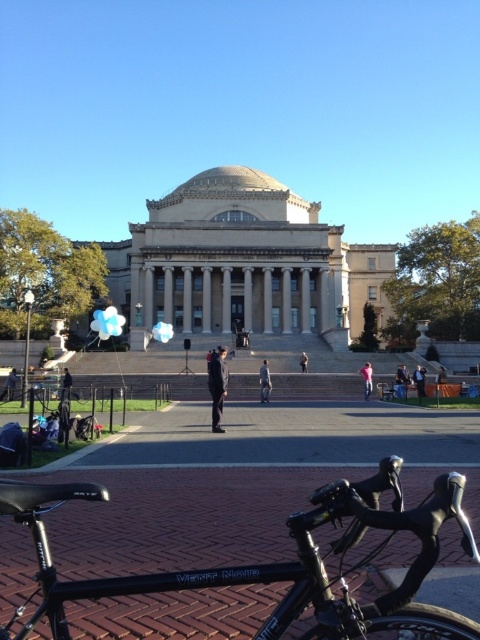
You are standing in front of the grand neoclassical building and see a light blue fabric person at center and a camouflage fabric jacket at center. Which one is positioned more to the left side?

The light blue fabric person at center is positioned more to the left side because it is to the left of the camouflage fabric jacket at center.

You are a photographer planning to take a portrait of two people wearing the dark blue suit at center and the black fabric jacket at lower left. Since you want them to appear side by side in the photo, which one should you position on the left to match their current positions in the image?

To match their current positions in the image, you should position the black fabric jacket at lower left on the left side of the photo, as the dark blue suit at center is currently to the right of the black fabric jacket at lower left.

You are standing at the entrance of the grand neoclassical building and want to know how far you are from the point marked as point [266,401]. Can you determine the distance?

The distance between you and point [266,401] is 79.36 meters.